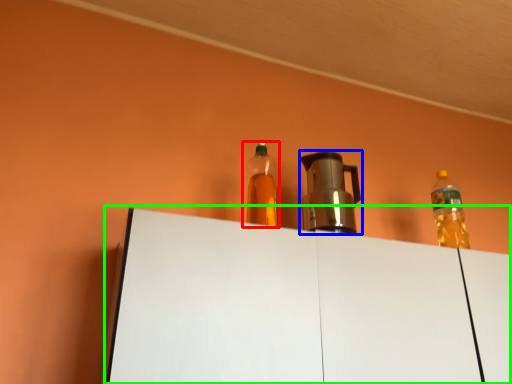
Question: Which is farther away from bottle (highlighted by a red box)? coffeepot (highlighted by a blue box) or table (highlighted by a green box)?

Choices:
 (A) coffeepot
 (B) table

Answer: (A)